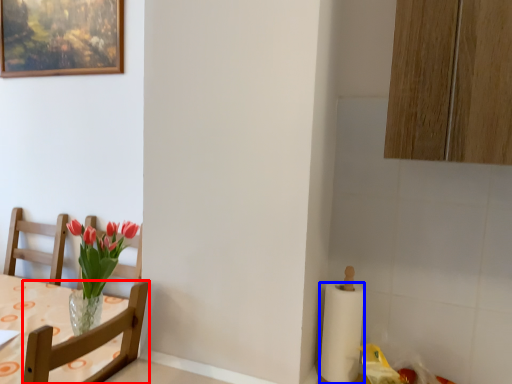
Question: Which point is closer to the camera, chair (highlighted by a red box) or paper towel (highlighted by a blue box)?

Choices:
 (A) chair
 (B) paper towel

Answer: (A)